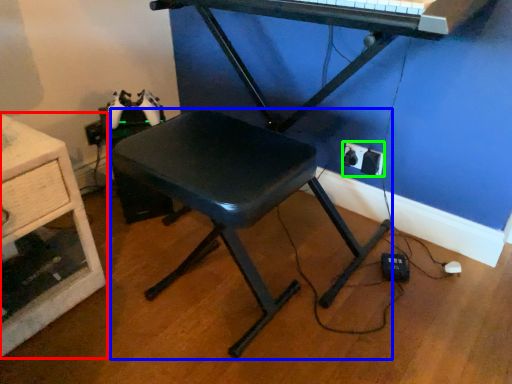
Question: Based on their relative distances, which object is nearer to furniture (highlighted by a red box)? Choose from stool (highlighted by a blue box) and electric outlet (highlighted by a green box).

Choices:
 (A) stool
 (B) electric outlet

Answer: (A)